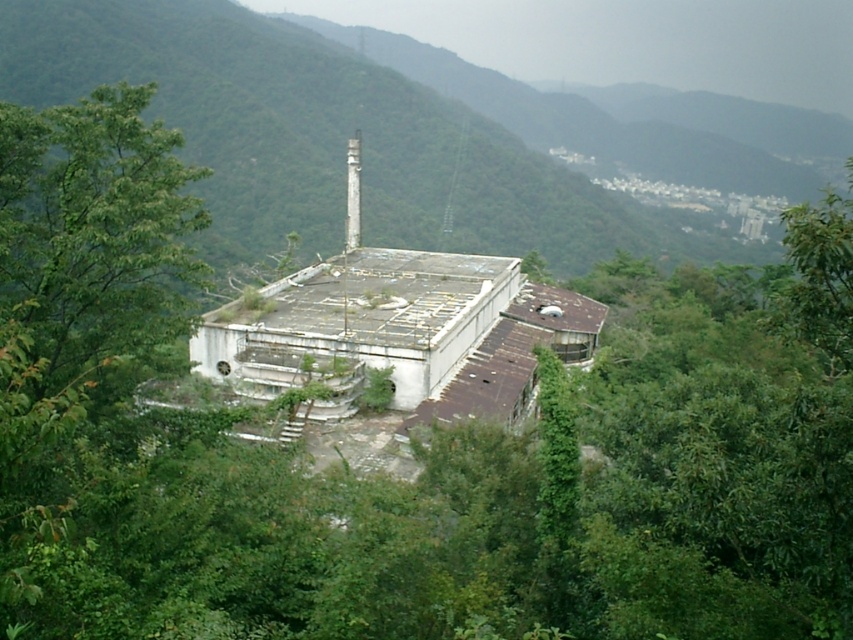
Does point (277, 147) lie behind point (347, 208)?

Yes, point (277, 147) is farther from viewer.

Which is in front, point (308, 115) or point (358, 147)?

Point (358, 147) is in front.

In order to click on green mossy roof at center in this screenshot , I will do `click(421, 134)`.